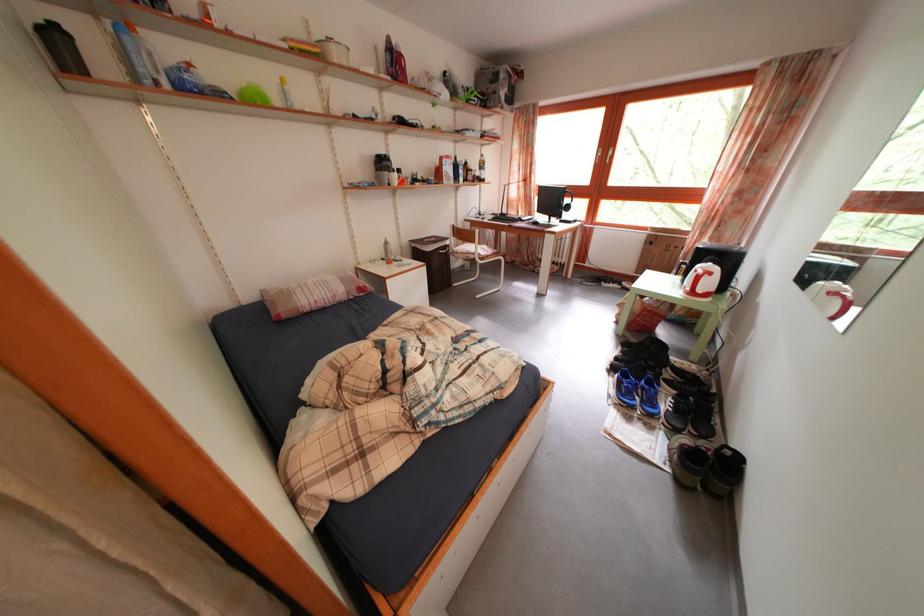
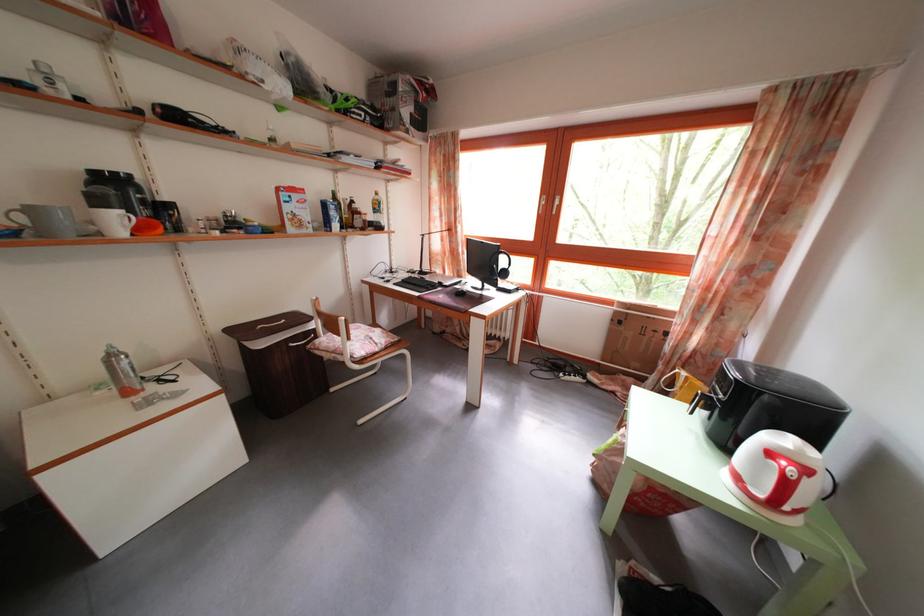
Locate, in the second image, the point that corresponds to point (468, 174) in the first image.

(338, 214)